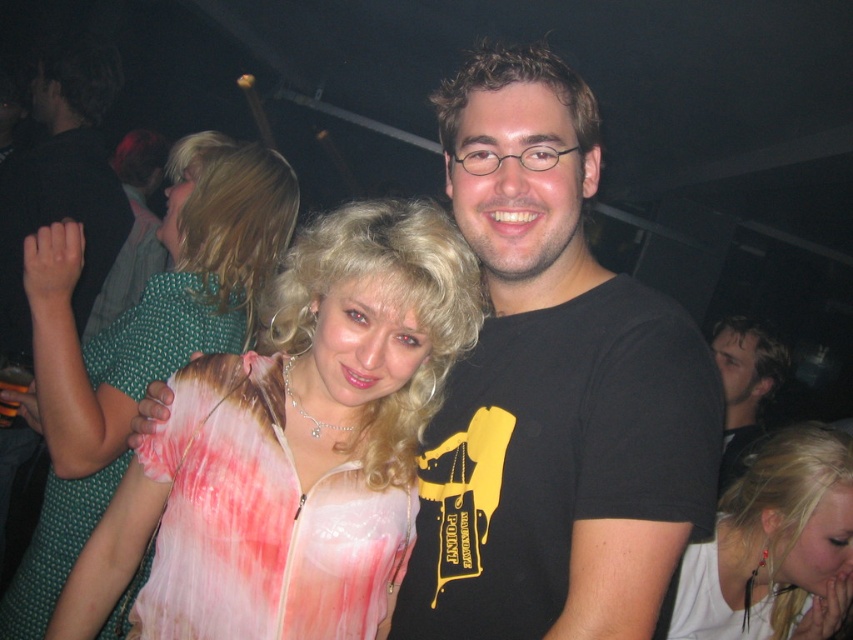
Locate an element on the screen. black matte t-shirt at center is located at coordinates (552, 392).

Where is `black matte t-shirt at center`? The width and height of the screenshot is (853, 640). black matte t-shirt at center is located at coordinates (552, 392).

Find the location of a particular element. black matte t-shirt at center is located at coordinates (552, 392).

Between white lace dress at upper left and white matte/soft hair at lower right, which one is positioned higher?

white lace dress at upper left is higher up.

What do you see at coordinates (140, 340) in the screenshot?
I see `white lace dress at upper left` at bounding box center [140, 340].

Who is more distant from viewer, (125, 413) or (717, 608)?

Positioned behind is point (717, 608).

The image size is (853, 640). I want to click on white lace dress at upper left, so click(x=140, y=340).

Can you confirm if white matte/soft hair at lower right is wider than black t-shirt at center?

No, white matte/soft hair at lower right is not wider than black t-shirt at center.

Between point (775, 445) and point (724, 474), which one is positioned in front?

Point (775, 445) is more forward.

From the picture: Measure the distance between white matte/soft hair at lower right and camera.

white matte/soft hair at lower right and camera are 5.46 feet apart from each other.

Locate an element on the screen. This screenshot has width=853, height=640. white matte/soft hair at lower right is located at coordinates (775, 545).